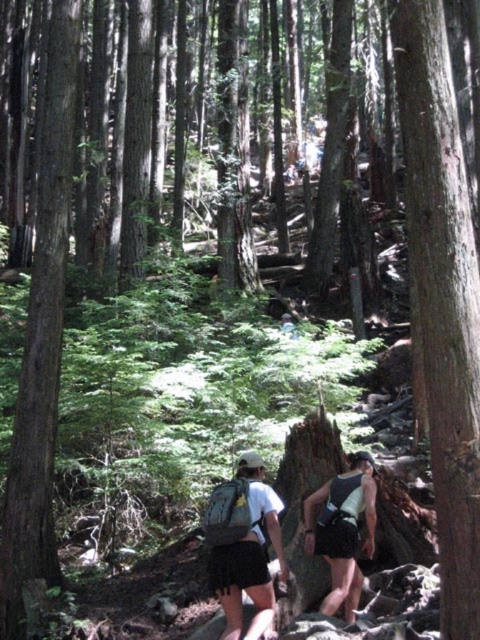
Does matte green backpack at center appear on the right side of black mesh backpack at center?

No, matte green backpack at center is not to the right of black mesh backpack at center.

Is matte green backpack at center below black mesh backpack at center?

Actually, matte green backpack at center is above black mesh backpack at center.

Find the location of a particular element. matte green backpack at center is located at coordinates (249, 554).

Does white cotton t-shirt at center come behind matte green backpack at center?

Yes.

Can you confirm if white cotton t-shirt at center is shorter than matte green backpack at center?

Correct, white cotton t-shirt at center is not as tall as matte green backpack at center.

At what (x,y) coordinates should I click in order to perform the action: click on white cotton t-shirt at center. Please return your answer as a coordinate pair (x, y). Image resolution: width=480 pixels, height=640 pixels. Looking at the image, I should click on (343, 529).

Locate an element on the screen. This screenshot has width=480, height=640. white cotton t-shirt at center is located at coordinates (343, 529).

Which is above, white cotton t-shirt at center or black mesh backpack at center?

Positioned higher is white cotton t-shirt at center.

Who is positioned more to the right, white cotton t-shirt at center or black mesh backpack at center?

black mesh backpack at center is more to the right.

Does point (343, 540) come farther from viewer compared to point (338, 580)?

That is False.

The image size is (480, 640). I want to click on white cotton t-shirt at center, so click(343, 529).